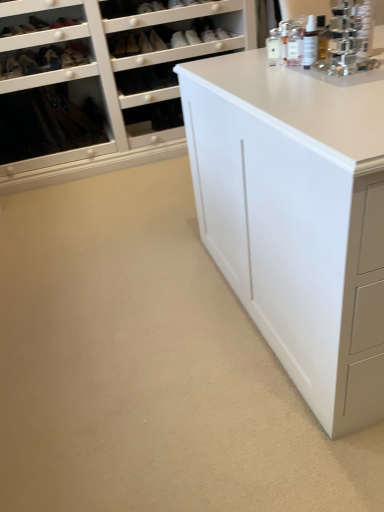
Question: Which direction should I rotate to look at matte black shoe at upper center, positioned as the third shoe in left-to-right order?

Choices:
 (A) left
 (B) right

Answer: (A)

Question: Can you see clear plastic spray bottle at upper right, which is the 1th toiletry in right-to-left order, touching matte black shoe at upper left, the 3th shoe viewed from the right?

Choices:
 (A) yes
 (B) no

Answer: (B)

Question: Is clear plastic spray bottle at upper right, which is the 1th toiletry in right-to-left order, shorter than matte black shoe at upper left, the 3th shoe viewed from the right?

Choices:
 (A) yes
 (B) no

Answer: (B)

Question: From a real-world perspective, is clear plastic spray bottle at upper right, which is the second toiletry in left-to-right order, on top of matte black shoe at upper left, the 1th shoe from the left?

Choices:
 (A) yes
 (B) no

Answer: (A)

Question: Is the depth of clear plastic spray bottle at upper right, the second toiletry from the back, less than that of matte black shoe at upper left, the 3th shoe viewed from the right?

Choices:
 (A) no
 (B) yes

Answer: (B)

Question: Is clear plastic spray bottle at upper right, the second toiletry from the back, far away from matte black shoe at upper left, the 1th shoe from the left?

Choices:
 (A) yes
 (B) no

Answer: (A)

Question: From the image's perspective, would you say clear plastic spray bottle at upper right, which is the 1th toiletry in right-to-left order, is shown under matte black shoe at upper left, the 1th shoe from the left?

Choices:
 (A) no
 (B) yes

Answer: (B)

Question: Does matte black shoe at upper left, the 3th shoe viewed from the right, have a greater height compared to white glass bottle at upper right, the second toiletry viewed from the front?

Choices:
 (A) yes
 (B) no

Answer: (A)

Question: From a real-world perspective, is matte black shoe at upper left, the 1th shoe from the left, positioned under white glass bottle at upper right, which is the second toiletry in right-to-left order, based on gravity?

Choices:
 (A) yes
 (B) no

Answer: (A)

Question: Does matte black shoe at upper left, the 3th shoe viewed from the right, have a larger size compared to white glass bottle at upper right, arranged as the first toiletry when viewed from the left?

Choices:
 (A) yes
 (B) no

Answer: (A)

Question: From the image's perspective, is matte black shoe at upper left, the 1th shoe from the left, located beneath white glass bottle at upper right, the second toiletry viewed from the front?

Choices:
 (A) yes
 (B) no

Answer: (B)

Question: Is matte black shoe at upper left, the 3th shoe viewed from the right, facing towards white glass bottle at upper right, the second toiletry viewed from the front?

Choices:
 (A) yes
 (B) no

Answer: (B)

Question: Is white glass bottle at upper right, the second toiletry viewed from the front, a part of matte black shoe at upper left, the 3th shoe viewed from the right?

Choices:
 (A) yes
 (B) no

Answer: (B)

Question: Is clear plastic spray bottle at upper right, which is the second toiletry in left-to-right order, inside matte black shoe at upper center, arranged as the 1th shoe when viewed from the right?

Choices:
 (A) yes
 (B) no

Answer: (B)